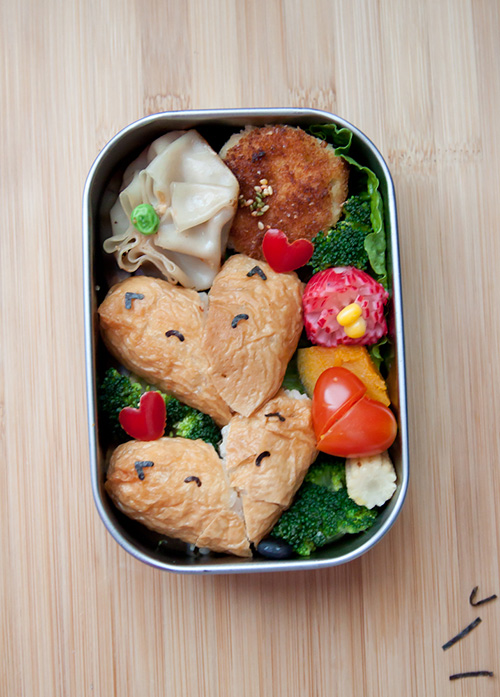
You are a GUI agent. You are given a task and a screenshot of the screen. Output one action in this format:
    pyautogui.click(x=<x>, y=<y>)
    Task: Click on the wooden table surface
    This screenshot has width=500, height=697.
    Given the screenshot: What is the action you would take?
    pyautogui.click(x=302, y=627)